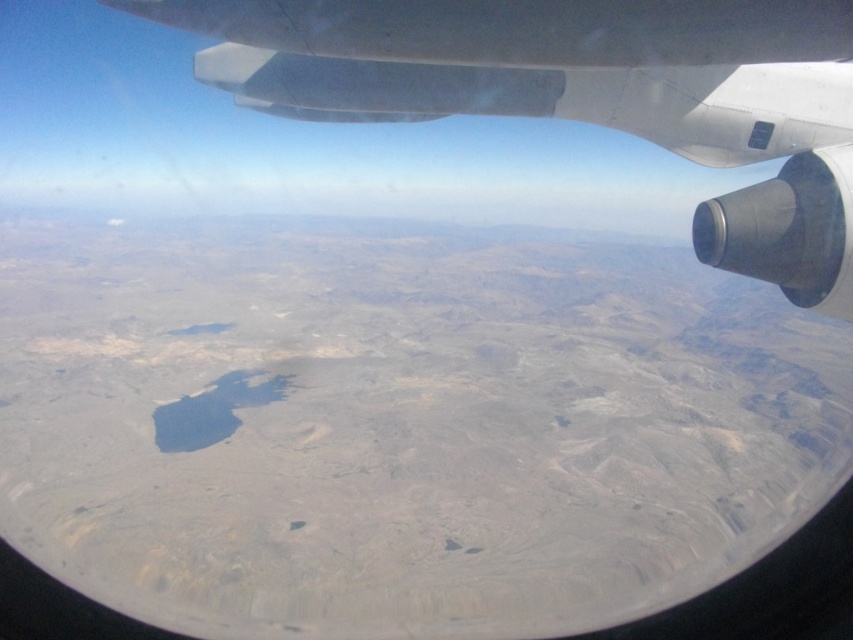
You are sitting by the airplane window and notice two points on the desert terrain below. The first point is at coordinates point (544, 24) and the second is at point (334, 19). Which point appears closer to you through the window?

Point (544, 24) is closer to the camera than point (334, 19), so the first point appears closer to you through the airplane window.

You are sitting in an airplane seat and looking out the window. There is a point marked at coordinates (x=386, y=33) in your field of view. If you want to reach for a book on the seat next to you, which is 1.2 meters away from you, will the point remain visible in your field of view?

The point at (x=386, y=33) is 10.43 meters away from the camera. Since the book on the seat next to you is only 1.2 meters away, moving your head to reach for it won